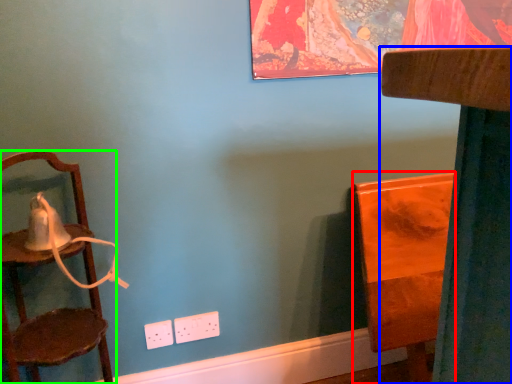
Question: Based on their relative distances, which object is nearer to furniture (highlighted by a red box)? Choose from furniture (highlighted by a blue box) and chair (highlighted by a green box).

Choices:
 (A) furniture
 (B) chair

Answer: (A)